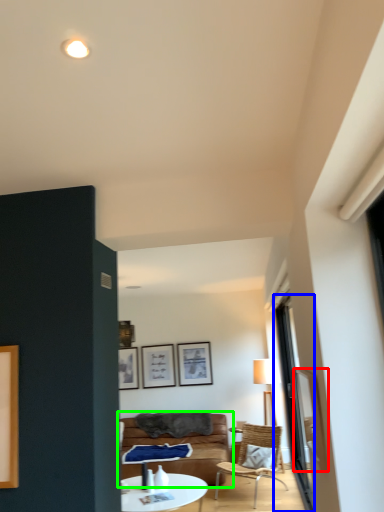
Question: Estimate the real-world distances between objects in this image. Which object is closer to window screen (highlighted by a red box), window (highlighted by a blue box) or studio couch (highlighted by a green box)?

Choices:
 (A) window
 (B) studio couch

Answer: (A)